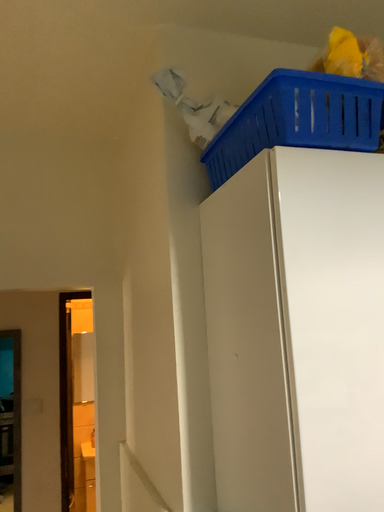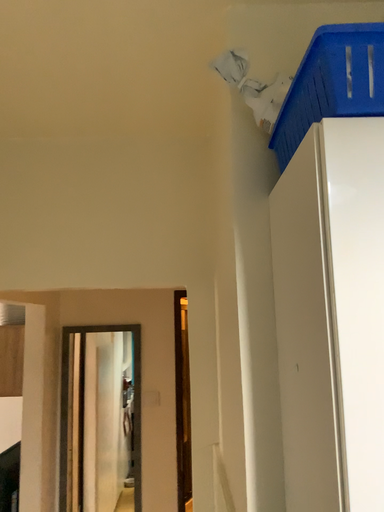
Question: How did the camera likely rotate when shooting the video?

Choices:
 (A) rotated left
 (B) rotated right

Answer: (A)